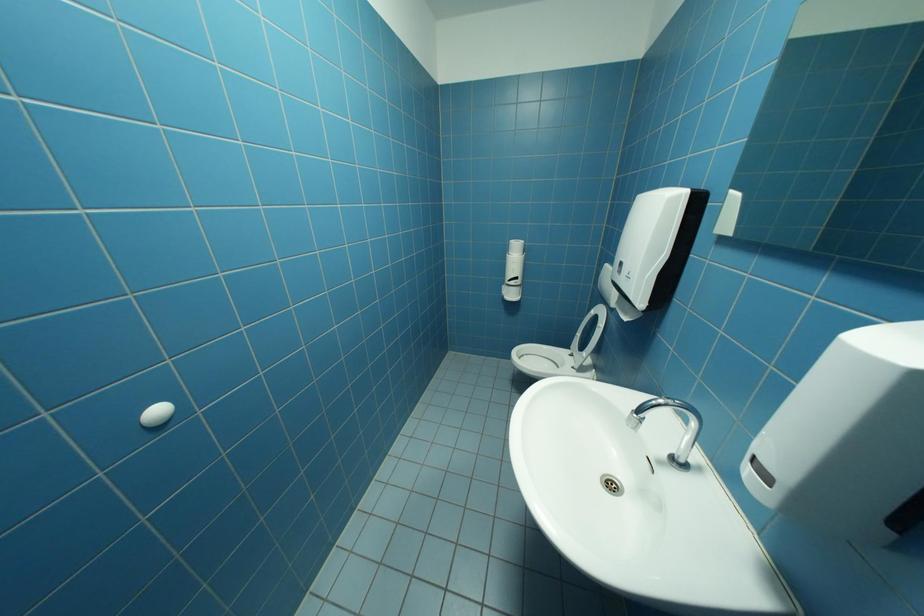
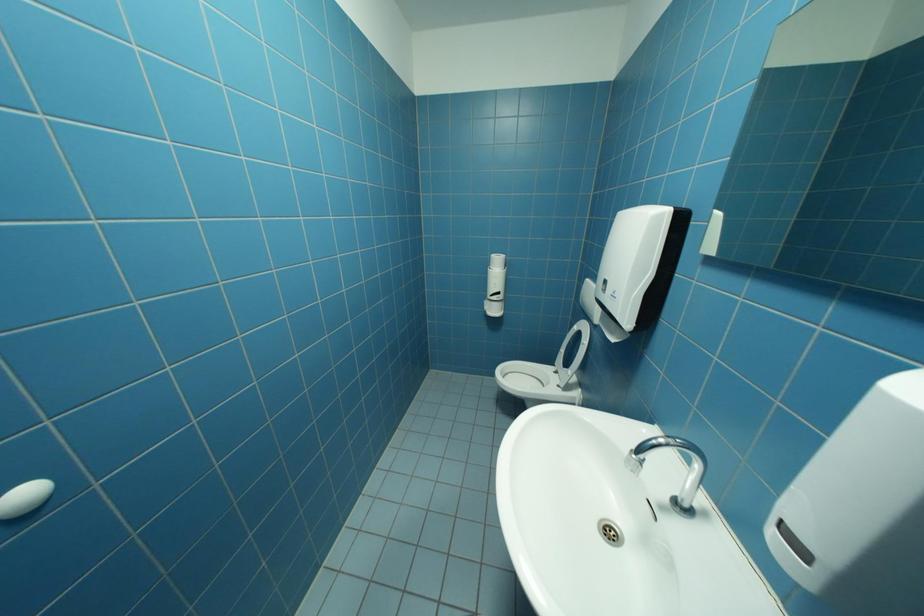
Question: What movement of the cameraman would produce the second image?

Choices:
 (A) Left
 (B) Right
 (C) Forward
 (D) Backward

Answer: (C)